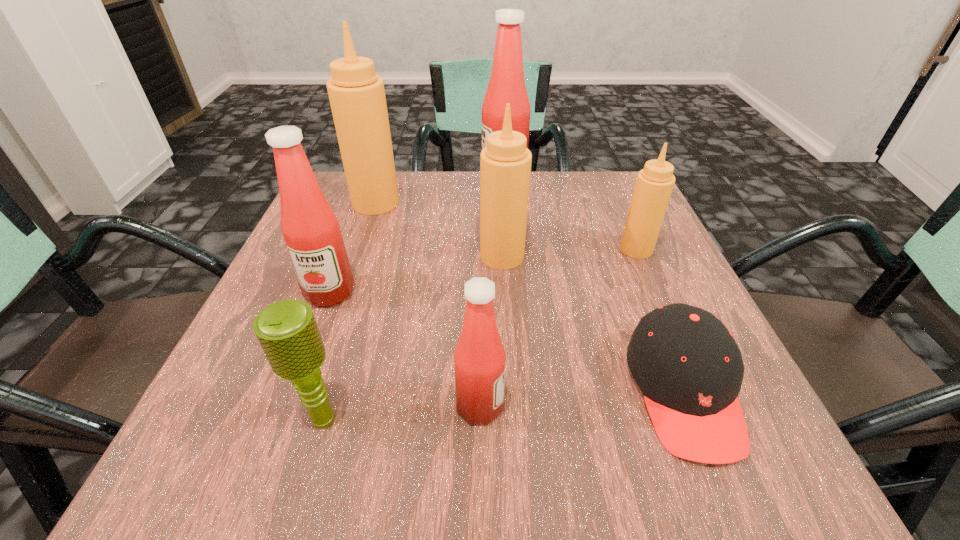
Identify the location of vacant space at the far edge. This screenshot has height=540, width=960. (416, 221).

At what (x,y) coordinates should I click in order to perform the action: click on free region at the near edge of the desktop. Please return your answer as a coordinate pair (x, y). This screenshot has width=960, height=540. Looking at the image, I should click on (502, 423).

Where is `free space at the left edge`? Image resolution: width=960 pixels, height=540 pixels. free space at the left edge is located at coordinates (293, 283).

Where is `free region at the right edge of the desktop`? The image size is (960, 540). free region at the right edge of the desktop is located at coordinates (660, 236).

You are a GUI agent. You are given a task and a screenshot of the screen. Output one action in this format:
    pyautogui.click(x=<x>, y=<y>)
    Task: Click on the free space at the far left corner of the desktop
    The height and width of the screenshot is (540, 960).
    Given the screenshot: What is the action you would take?
    pyautogui.click(x=347, y=197)

This screenshot has width=960, height=540. In the image, there is a desktop. What are the coordinates of `vacant area at the far right corner` in the screenshot? It's located at (586, 204).

Locate an element on the screen. This screenshot has width=960, height=540. vacant space that is in between the second tan condiment from left to right and the cap is located at coordinates (593, 324).

Where is `free space between the microphone and the shortest object`? This screenshot has width=960, height=540. free space between the microphone and the shortest object is located at coordinates (504, 404).

Where is `free point between the second biggest tan condiment and the shortest object`? free point between the second biggest tan condiment and the shortest object is located at coordinates (593, 324).

This screenshot has height=540, width=960. I want to click on free point between the shortest object and the nearest red condiment, so click(582, 399).